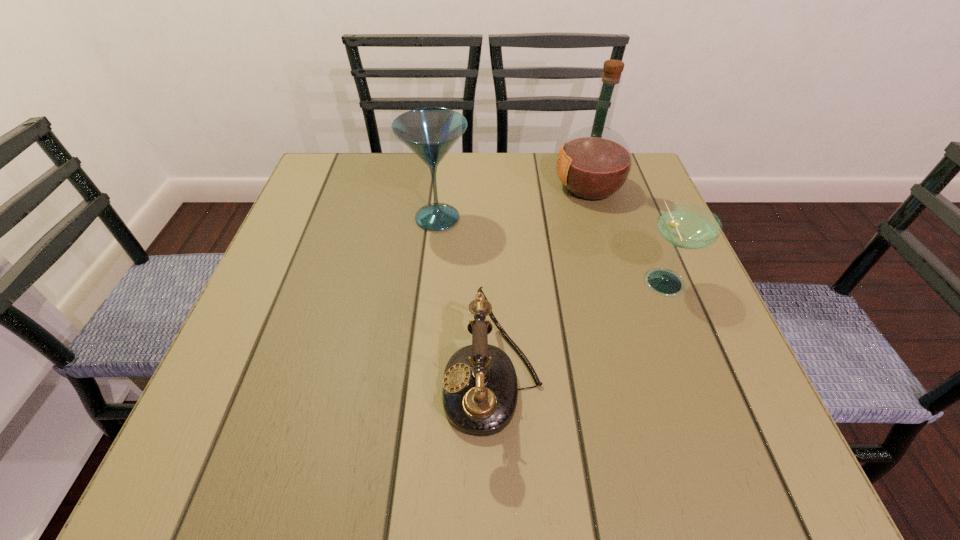
Locate an element on the screen. The height and width of the screenshot is (540, 960). free spot that satisfies the following two spatial constraints: 1. on the front side of the third farthest object; 2. on the left side of the second tallest object is located at coordinates (x=431, y=280).